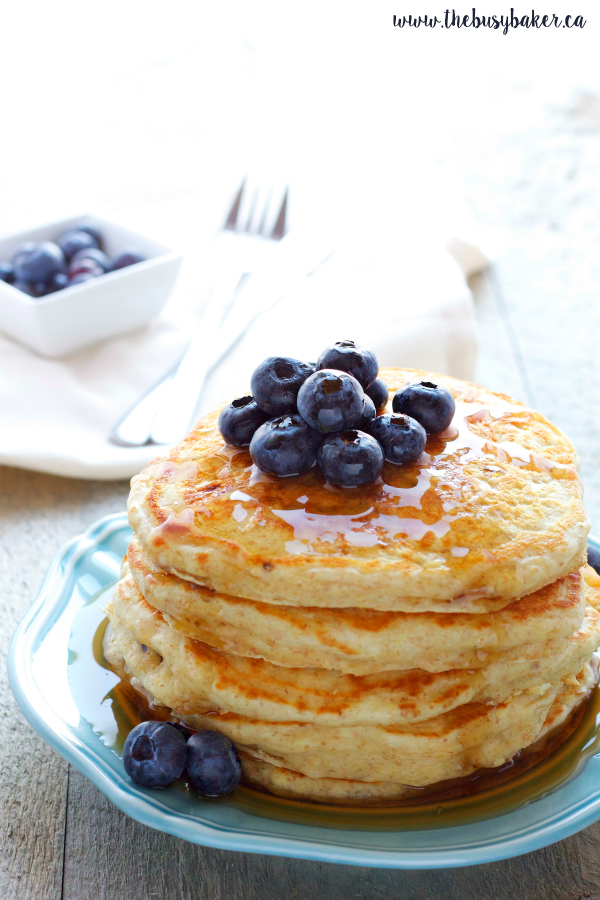
Where is `napkin`? The width and height of the screenshot is (600, 900). napkin is located at coordinates (393, 268).